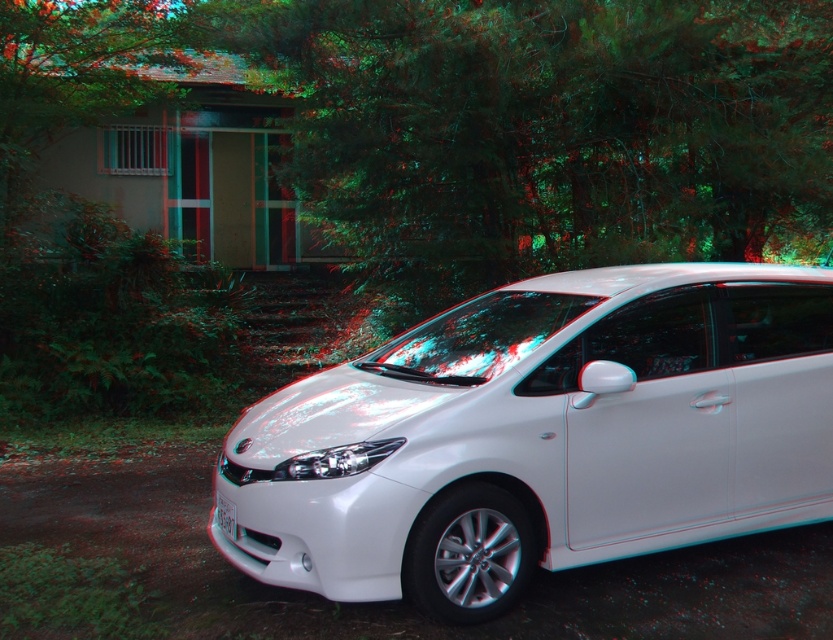
Is point (253, 477) positioned after point (217, 518)?

No, it is in front of (217, 518).

Who is shorter, white glossy car at center or white plastic license plate at center?

Standing shorter between the two is white plastic license plate at center.

Does point (657, 433) come closer to viewer compared to point (222, 513)?

No, (657, 433) is further to viewer.

At what (x,y) coordinates should I click in order to perform the action: click on white glossy car at center. Please return your answer as a coordinate pair (x, y). The width and height of the screenshot is (833, 640). Looking at the image, I should click on (541, 436).

Looking at this image, does white glossy car at center have a lesser height compared to green leafy tree at center?

Incorrect, white glossy car at center's height does not fall short of green leafy tree at center's.

Looking at this image, is white glossy car at center to the right of green leafy tree at center from the viewer's perspective?

Correct, you'll find white glossy car at center to the right of green leafy tree at center.

The height and width of the screenshot is (640, 833). Describe the element at coordinates (541, 436) in the screenshot. I see `white glossy car at center` at that location.

This screenshot has width=833, height=640. Identify the location of white glossy car at center. (541, 436).

Which is in front, point (338, 83) or point (227, 508)?

Point (227, 508)

Does green leafy tree at center appear on the left side of white plastic license plate at center?

Incorrect, green leafy tree at center is not on the left side of white plastic license plate at center.

Between point (771, 76) and point (215, 492), which one is positioned behind?

The point (771, 76) is behind.

At what (x,y) coordinates should I click in order to perform the action: click on green leafy tree at center. Please return your answer as a coordinate pair (x, y). The image size is (833, 640). Looking at the image, I should click on (545, 129).